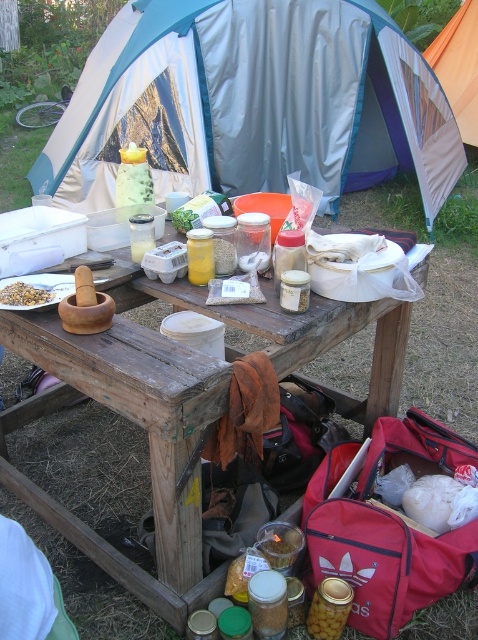
Question: Estimate the real-world distances between objects in this image. Which object is closer to the yellow glass jar at center?

Choices:
 (A) blue fabric tent at upper center
 (B) orange fabric tent at upper center

Answer: (A)

Question: Can you confirm if orange fabric tent at upper center is bigger than yellow glass jar at center?

Choices:
 (A) yes
 (B) no

Answer: (A)

Question: Estimate the real-world distances between objects in this image. Which object is farther from the orange fabric tent at upper center?

Choices:
 (A) yellow glass jar at center
 (B) brown grain at center
 (C) blue fabric tent at upper center
 (D) wooden picnic table at center

Answer: (B)

Question: Does blue fabric tent at upper center appear over wooden picnic table at center?

Choices:
 (A) no
 (B) yes

Answer: (B)

Question: Estimate the real-world distances between objects in this image. Which object is closer to the wooden picnic table at center?

Choices:
 (A) brown grain at center
 (B) blue fabric tent at upper center

Answer: (A)

Question: Does orange fabric tent at upper center have a smaller size compared to brown grain at center?

Choices:
 (A) no
 (B) yes

Answer: (A)